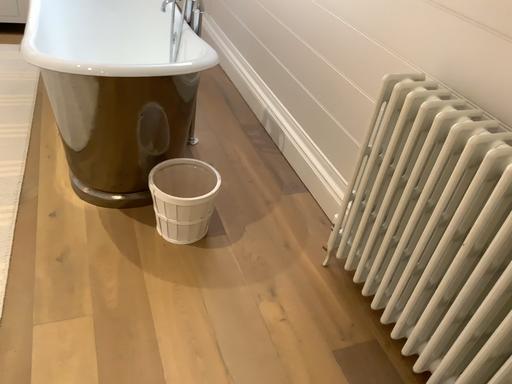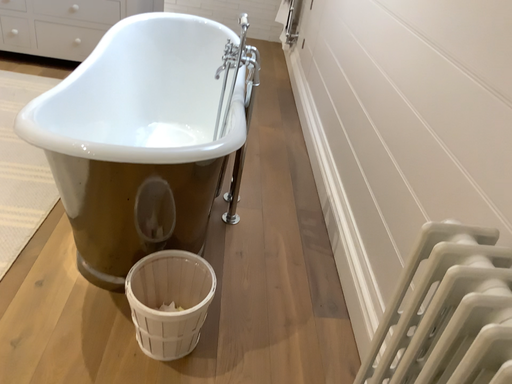
Question: Which way did the camera rotate in the video?

Choices:
 (A) rotated upward
 (B) rotated downward

Answer: (A)